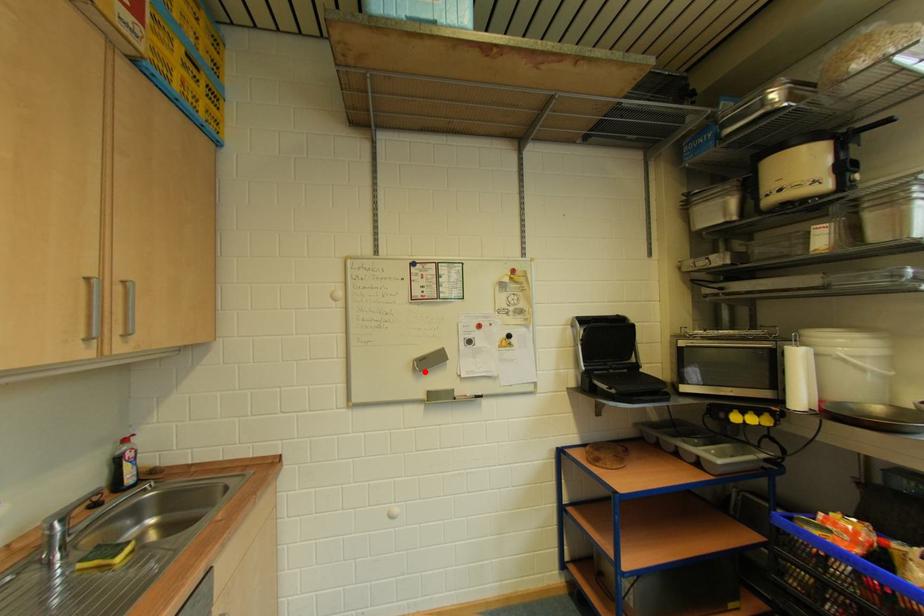
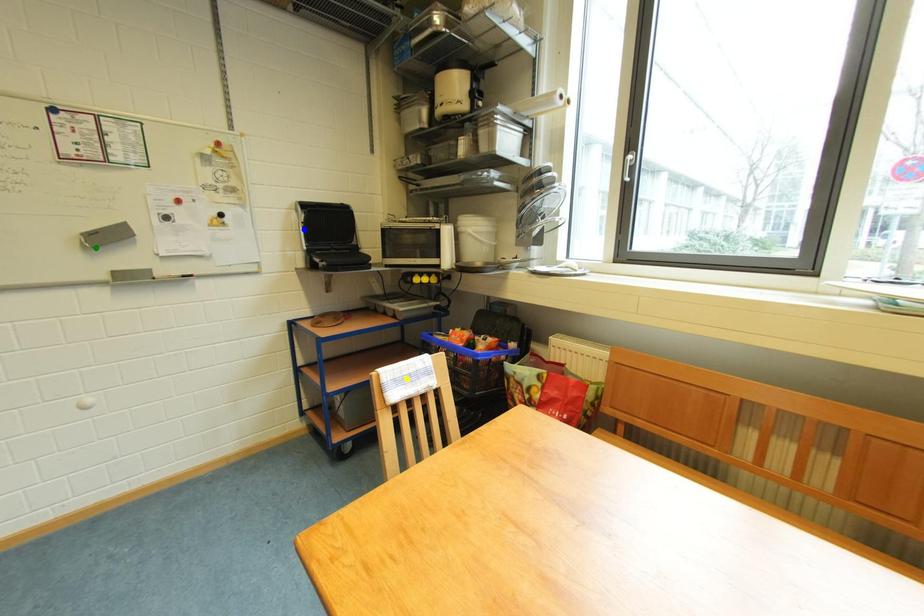
Question: I am providing you with two images of the same scene from different viewpoints. A red point is marked on the first image. You are given multiple points on the second image. Which spot in image 2 lines up with the point in image 1?

Choices:
 (A) yellow point
 (B) green point
 (C) blue point

Answer: (B)